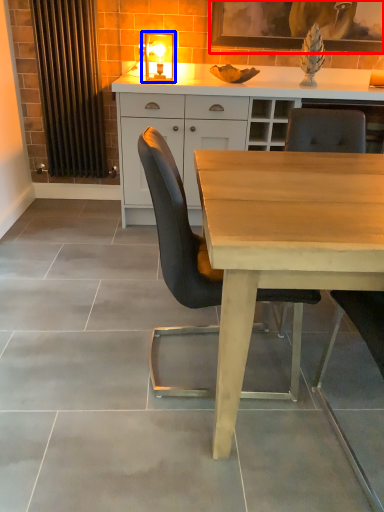
Question: Which of the following is the closest to the observer, picture frame (highlighted by a red box) or light fixture (highlighted by a blue box)?

Choices:
 (A) picture frame
 (B) light fixture

Answer: (B)